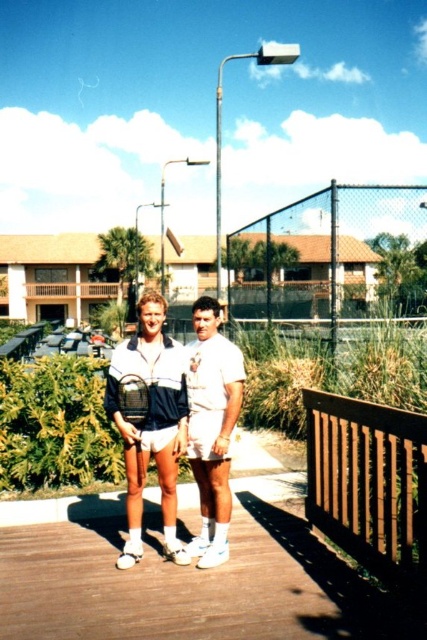
Question: Can you confirm if white matte shorts at center is positioned above black mesh racket at center?

Choices:
 (A) no
 (B) yes

Answer: (A)

Question: Which point is farther from the camera taking this photo?

Choices:
 (A) (131, 486)
 (B) (233, 376)

Answer: (B)

Question: Considering the real-world distances, which object is farthest from the white matte shorts at center?

Choices:
 (A) white cotton shorts at center
 (B) black mesh racket at center

Answer: (B)

Question: Where is white cotton shorts at center located in relation to black mesh racket at center in the image?

Choices:
 (A) right
 (B) left

Answer: (A)

Question: Among these objects, which one is farthest from the camera?

Choices:
 (A) black mesh racket at center
 (B) white cotton shorts at center
 (C) white matte shorts at center

Answer: (A)

Question: Does white cotton shorts at center appear on the right side of black mesh racket at center?

Choices:
 (A) yes
 (B) no

Answer: (A)